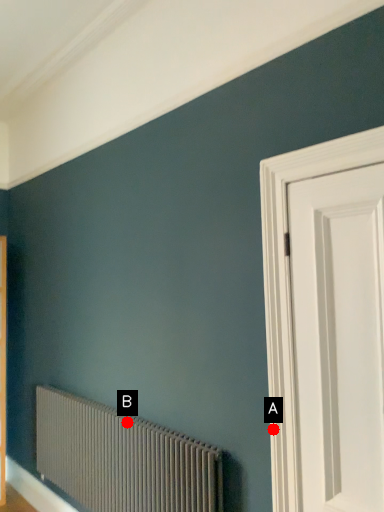
Question: Two points are circled on the image, labeled by A and B beside each circle. Among these points, which one is farthest from the camera?

Choices:
 (A) A is further
 (B) B is further

Answer: (B)